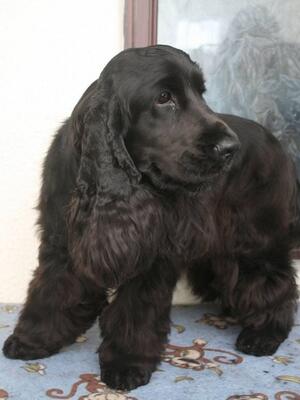
This screenshot has height=400, width=300. In order to click on wall in this screenshot , I will do `click(53, 93)`.